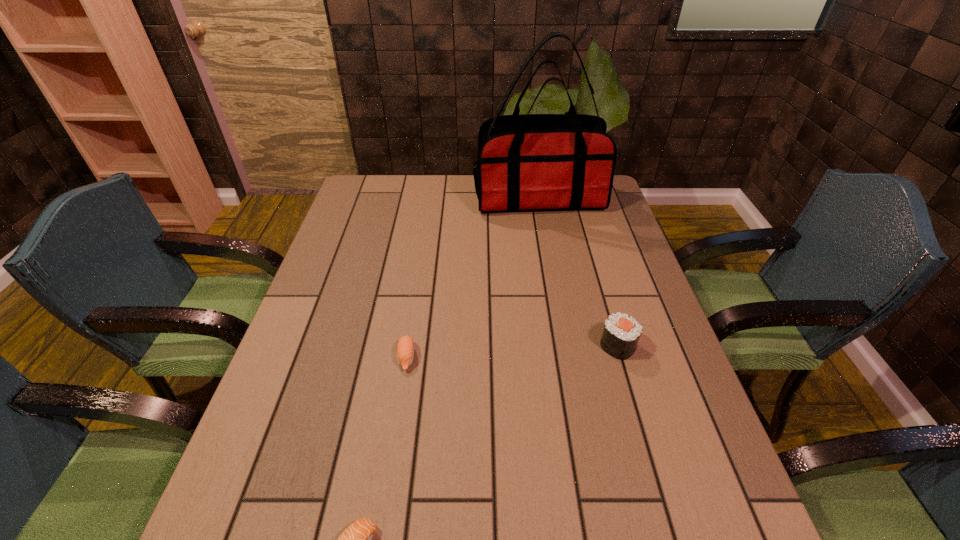
Where is `object that is the second closest one to the second tallest sushi`? object that is the second closest one to the second tallest sushi is located at coordinates (621, 334).

Point out which object is positioned as the third nearest to the second tallest sushi. Please provide its 2D coordinates. Your answer should be formatted as a tuple, i.e. [(x, y)], where the tuple contains the x and y coordinates of a point satisfying the conditions above.

[(532, 161)]

Where is `sushi that is the closest to the rightmost sushi`? This screenshot has height=540, width=960. sushi that is the closest to the rightmost sushi is located at coordinates (405, 349).

Identify which sushi is the second nearest to the tallest sushi. Please provide its 2D coordinates. Your answer should be formatted as a tuple, i.e. [(x, y)], where the tuple contains the x and y coordinates of a point satisfying the conditions above.

[(357, 539)]